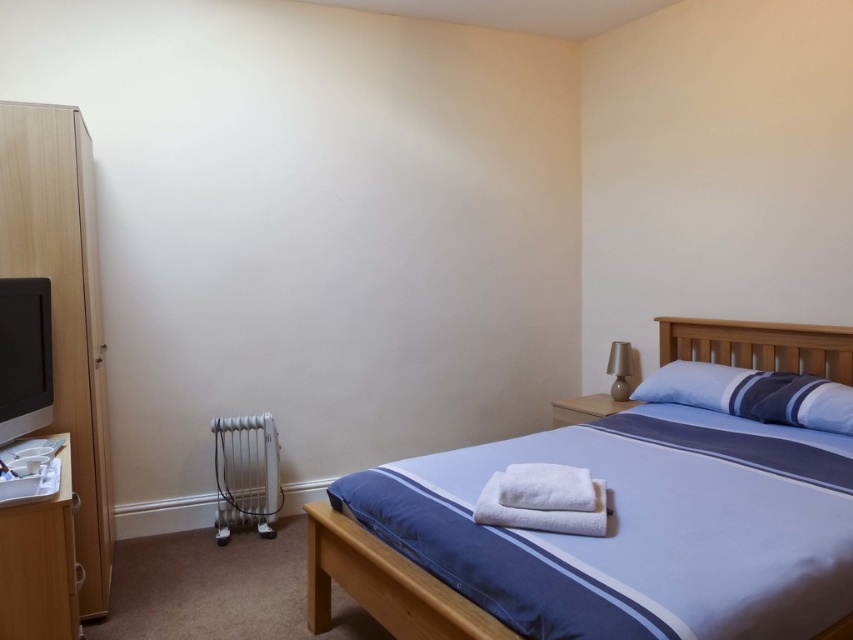
You are standing in the bedroom and want to place a small plant on a surface that is closer to you. Which object should you choose between the light wood dresser at left and the white metallic radiator at lower left?

The light wood dresser at left is in front of the white metallic radiator at lower left, so it is closer to you. You should place the plant on the light wood dresser at left.

You are standing in the bedroom and want to see the matte black monitor at left without moving your feet. Which direction should you turn your head to look past the blue fabric bed at center?

You should turn your head to the left to look past the blue fabric bed at center and see the matte black monitor at left, since the monitor is behind the bed.

You are a delivery person who just brought a new 30 inch wide TV stand. You need to place it between the light wood dresser at left and the white metallic radiator at lower left. Is there enough space between them to fit the TV stand?

The distance between the light wood dresser at left and the white metallic radiator at lower left is 28.48 inches. Since the TV stand is 30 inches wide, there isn not enough space to place it between them.